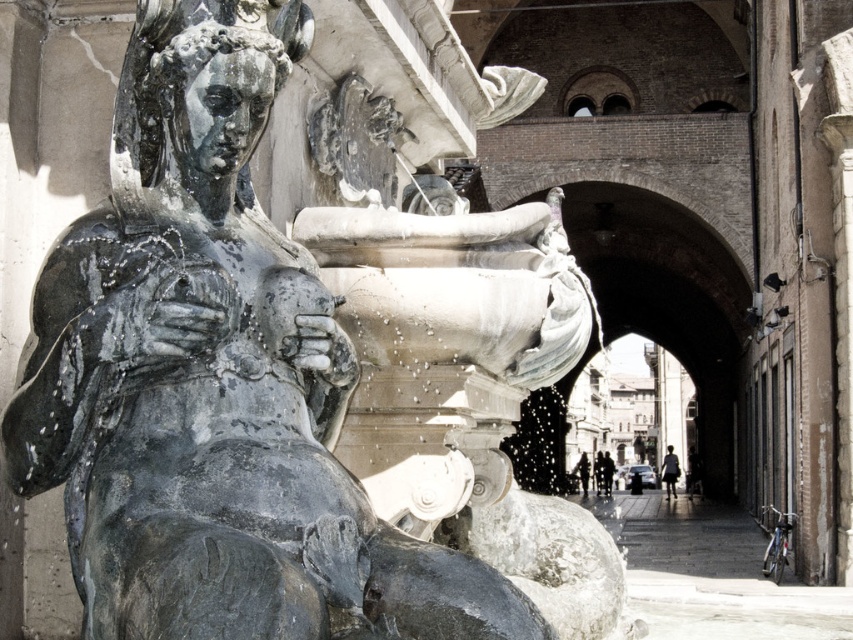
Which is above, bronze statue at left or dark fabric coat at center?

bronze statue at left is above.

The width and height of the screenshot is (853, 640). What do you see at coordinates (213, 380) in the screenshot? I see `bronze statue at left` at bounding box center [213, 380].

This screenshot has height=640, width=853. In order to click on bronze statue at left in this screenshot , I will do `click(213, 380)`.

Does silhouette fabric person at center have a smaller size compared to dark fabric coat at center?

Incorrect, silhouette fabric person at center is not smaller in size than dark fabric coat at center.

Is silhouette fabric person at center further to the viewer compared to dark fabric coat at center?

Yes, it is.

Locate an element on the screen. This screenshot has height=640, width=853. silhouette fabric person at center is located at coordinates (670, 470).

Locate an element on the screen. silhouette fabric person at center is located at coordinates (670, 470).

Is point (579, 454) less distant than point (604, 468)?

No, (579, 454) is behind (604, 468).

Does dark gray fabric person at center have a greater height compared to dark fabric coat at center?

No, dark gray fabric person at center is not taller than dark fabric coat at center.

Between point (583, 481) and point (602, 470), which one is positioned behind?

Point (602, 470)

The width and height of the screenshot is (853, 640). Identify the location of dark gray fabric person at center. (582, 472).